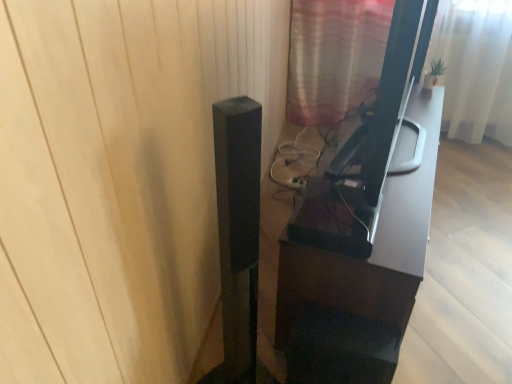
The height and width of the screenshot is (384, 512). What are the coordinates of `vacant space to the right of black glossy tv stand at center` in the screenshot? It's located at (476, 223).